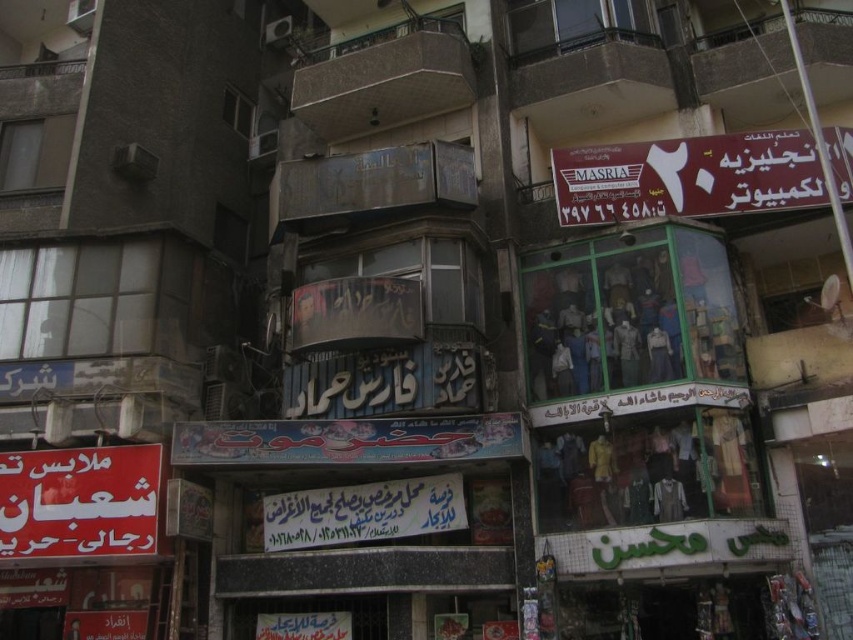
Between point (753, 173) and point (109, 484), which one is positioned behind?

Positioned behind is point (753, 173).

Between maroon plastic signboard at upper right and red fabric sign at lower left, which one is positioned lower?

Positioned lower is red fabric sign at lower left.

Does point (624, 157) lie behind point (120, 468)?

Yes, it is.

At what (x,y) coordinates should I click in order to perform the action: click on maroon plastic signboard at upper right. Please return your answer as a coordinate pair (x, y). Looking at the image, I should click on (688, 177).